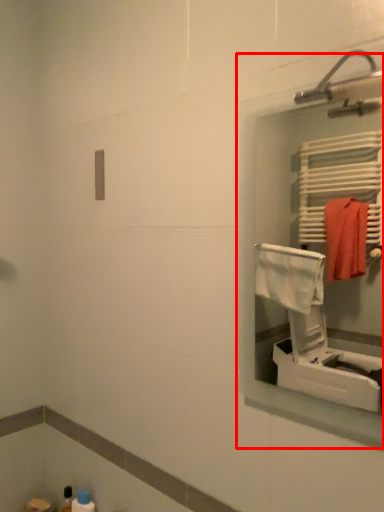
Question: Considering the relative positions of medicine cabinet (annotated by the red box) and toiletry in the image provided, where is medicine cabinet (annotated by the red box) located with respect to the staircase?

Choices:
 (A) left
 (B) right

Answer: (B)